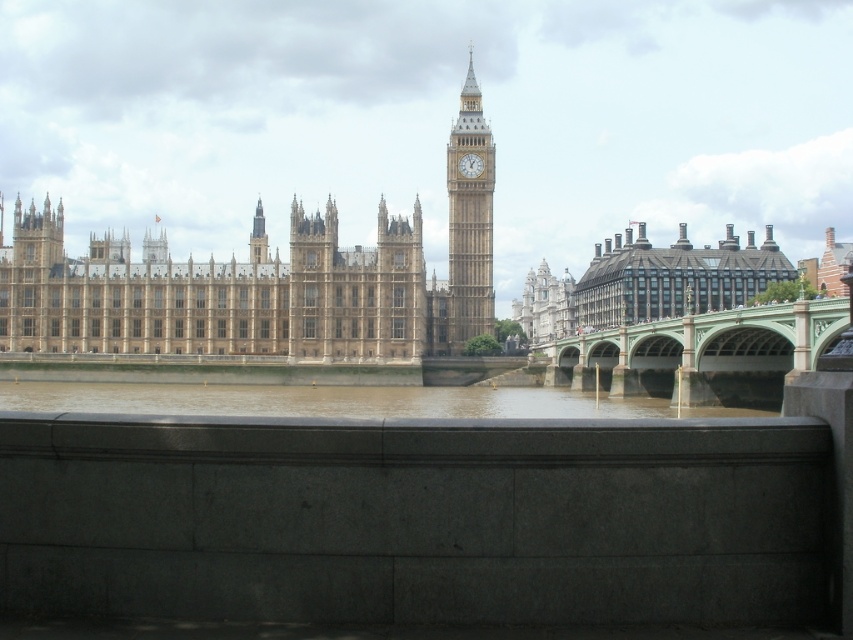
What are the coordinates of `green stone bridge at center` in the screenshot? It's located at (701, 355).

Looking at this image, is green stone bridge at center above golden stone clock tower at center?

No, green stone bridge at center is not above golden stone clock tower at center.

Is point (556, 364) positioned behind point (476, 100)?

No, (556, 364) is in front of (476, 100).

At what (x,y) coordinates should I click in order to perform the action: click on green stone bridge at center. Please return your answer as a coordinate pair (x, y). The width and height of the screenshot is (853, 640). Looking at the image, I should click on (701, 355).

Who is positioned more to the right, green stone bridge at center or brown muddy water at center?

Positioned to the right is green stone bridge at center.

Measure the distance between point (724,397) and camera.

Point (724,397) and camera are 143.82 meters apart.

Locate an element on the screen. The image size is (853, 640). green stone bridge at center is located at coordinates (701, 355).

Is beige stone building at center behind golden stone clock tower at center?

No, it is in front of golden stone clock tower at center.

Which is below, beige stone building at center or golden stone clock tower at center?

beige stone building at center is lower down.

Does point (288, 323) come closer to viewer compared to point (490, 168)?

Yes, point (288, 323) is in front of point (490, 168).

In order to click on beige stone building at center in this screenshot , I will do `click(218, 292)`.